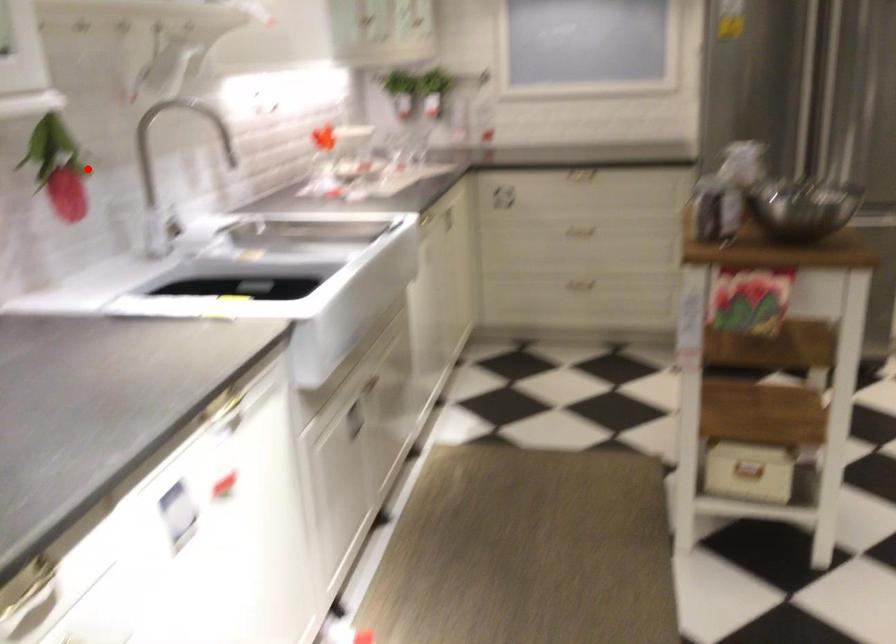
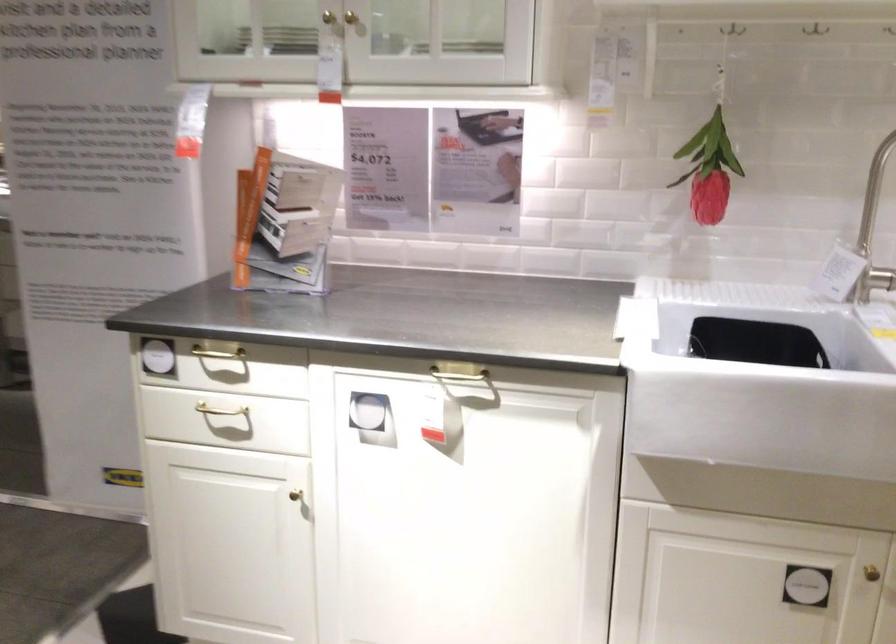
Locate, in the second image, the point that corresponds to the highlighted location in the first image.

(709, 169)